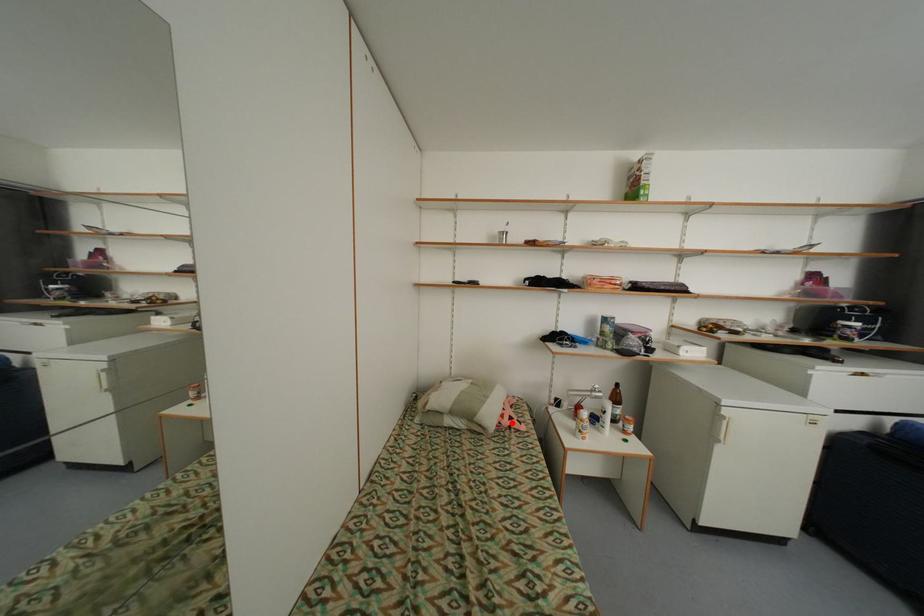
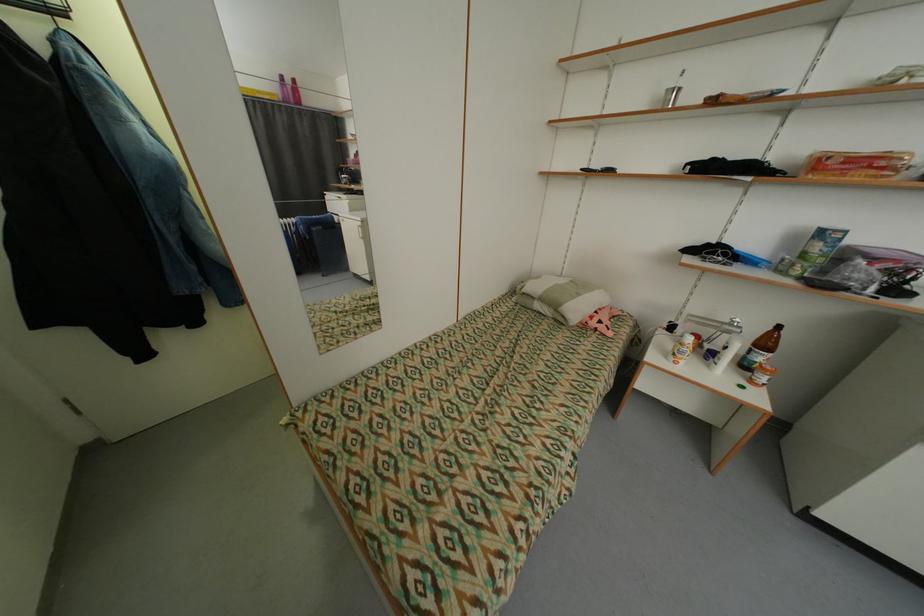
Question: I am providing you with two images of the same scene from different viewpoints. A red point is shown in image1. For the corresponding object point in image2, is it positioned nearer or farther from the camera?

Choices:
 (A) Nearer
 (B) Farther

Answer: (A)